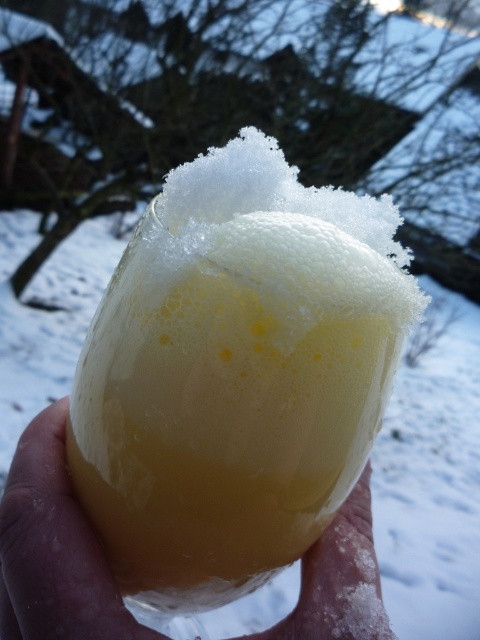
Question: Can you confirm if translucent glass at center is positioned below translucent plastic cup at center?

Choices:
 (A) yes
 (B) no

Answer: (B)

Question: Is translucent glass at center above translucent plastic cup at center?

Choices:
 (A) no
 (B) yes

Answer: (B)

Question: Which point appears closest to the camera in this image?

Choices:
 (A) (197, 442)
 (B) (14, 476)

Answer: (A)

Question: Which of the following is the farthest from the observer?

Choices:
 (A) translucent plastic cup at center
 (B) translucent glass at center

Answer: (A)

Question: Can you confirm if translucent glass at center is thinner than translucent plastic cup at center?

Choices:
 (A) no
 (B) yes

Answer: (B)